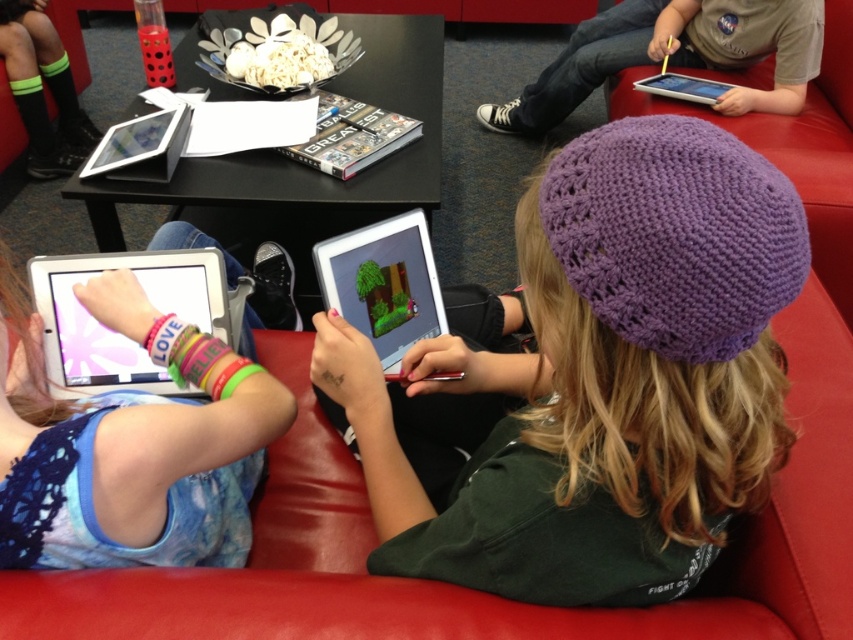
You are a teacher observing the children using their tablets. Which tablet, the white glossy tablet at left or the white glossy tablet at upper right, has a greater height?

The white glossy tablet at left is taller than the white glossy tablet at upper right according to the description.